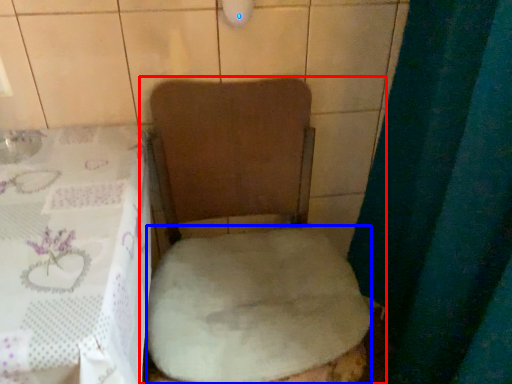
Question: Which object is further to the camera taking this photo, toilet (highlighted by a red box) or sheet (highlighted by a blue box)?

Choices:
 (A) toilet
 (B) sheet

Answer: (B)